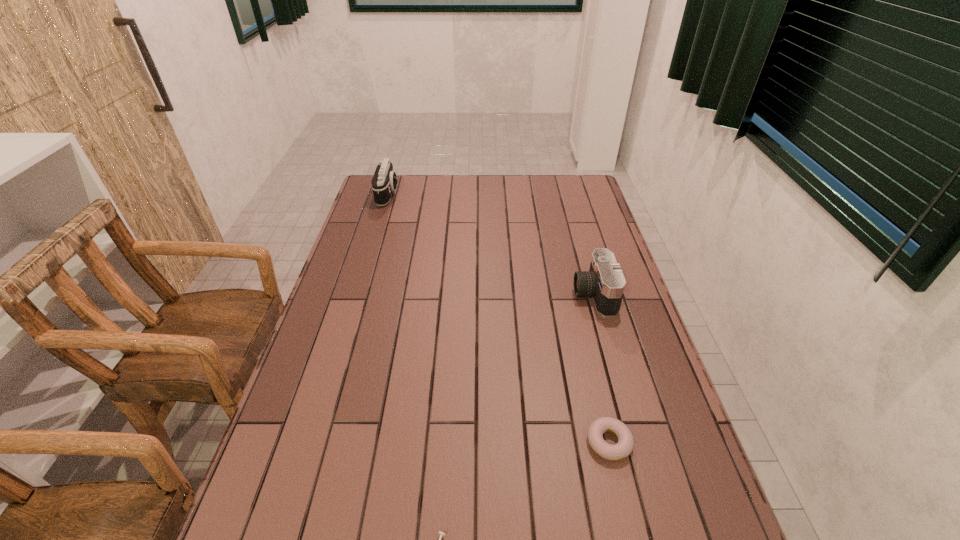
This screenshot has height=540, width=960. I want to click on the farther camera, so click(x=384, y=182).

Where is `the left camera`? the left camera is located at coordinates (384, 182).

This screenshot has width=960, height=540. I want to click on the third nearest object, so click(x=605, y=282).

Where is `the right camera`? The image size is (960, 540). the right camera is located at coordinates (605, 282).

Locate an element on the screen. The width and height of the screenshot is (960, 540). the third farthest object is located at coordinates (x=625, y=445).

This screenshot has width=960, height=540. Find the location of `the second shortest object`. the second shortest object is located at coordinates (625, 445).

The height and width of the screenshot is (540, 960). I want to click on free region located 0.350m on the front lens of the left camera, so click(485, 194).

Locate an element on the screen. This screenshot has width=960, height=540. free location located 0.400m on the front-facing side of the third nearest object is located at coordinates (444, 294).

Find the location of a particular element. vacant space located 0.260m on the front-facing side of the third nearest object is located at coordinates (489, 294).

Locate an element on the screen. This screenshot has height=540, width=960. vacant space located on the front-facing side of the third nearest object is located at coordinates (554, 294).